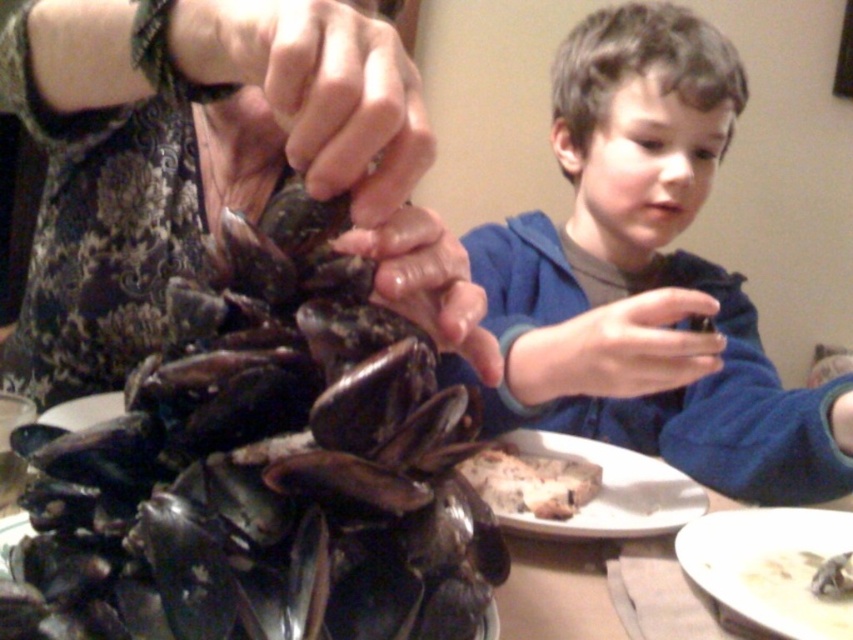
Question: Can you confirm if shiny dark shells at center is thinner than white matte bowl at lower right?

Choices:
 (A) yes
 (B) no

Answer: (B)

Question: Which object is closer to the camera taking this photo?

Choices:
 (A) blue fleece jacket at center
 (B) shiny dark shell at center
 (C) dark brown wooden platter at center
 (D) white crumbly bread at center

Answer: (B)

Question: In this image, where is dark brown wooden platter at center located relative to white crumbly bread at center?

Choices:
 (A) left
 (B) right

Answer: (B)

Question: Can you confirm if dark brown wooden platter at center is bigger than white crumbly bread at center?

Choices:
 (A) no
 (B) yes

Answer: (B)

Question: Which object appears closest to the camera in this image?

Choices:
 (A) shiny dark shells at center
 (B) shiny dark shell at center
 (C) dark brown wooden platter at center

Answer: (A)

Question: Which of the following is the closest to the observer?

Choices:
 (A) shiny dark shell at center
 (B) white matte bowl at lower right
 (C) shiny dark shells at center
 (D) blue fleece jacket at center

Answer: (C)